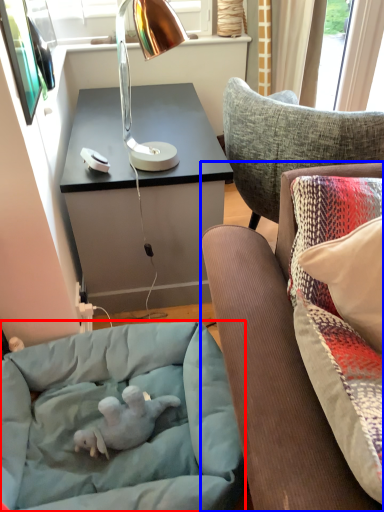
Question: Which point is further to the camera, dog bed (highlighted by a red box) or studio couch (highlighted by a blue box)?

Choices:
 (A) dog bed
 (B) studio couch

Answer: (A)